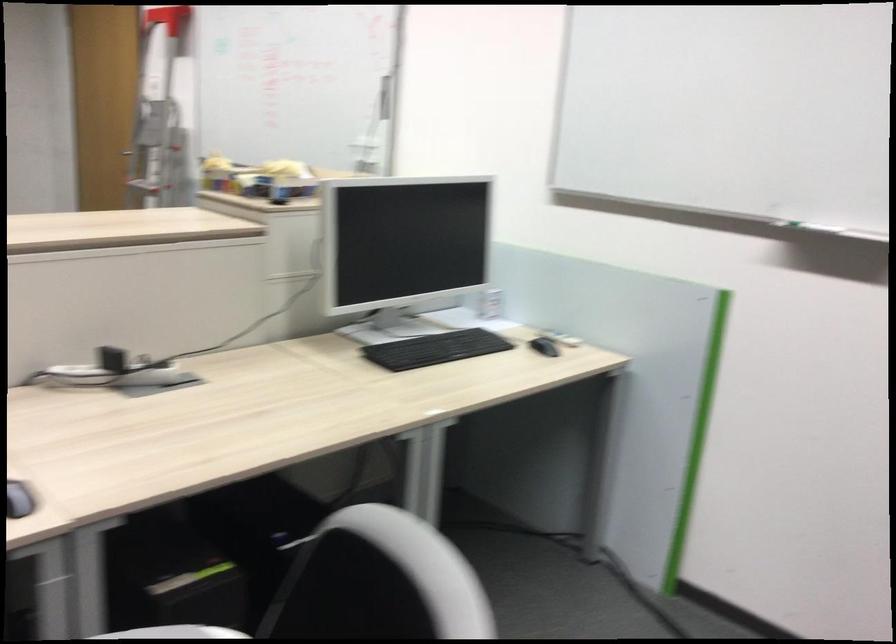
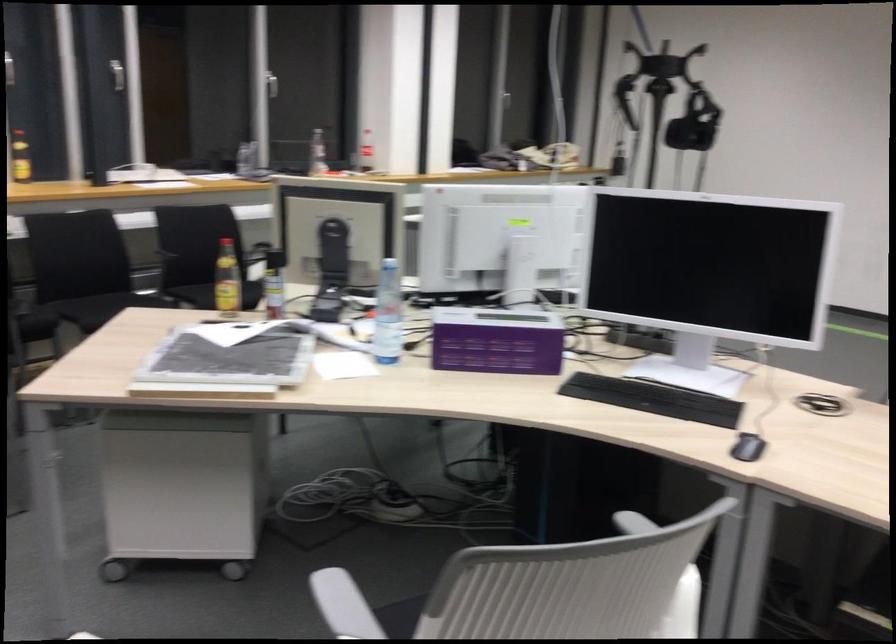
Question: The images are taken continuously from a first-person perspective. In which direction is your viewpoint rotating?

Choices:
 (A) Left
 (B) Right
 (C) Up
 (D) Down

Answer: (A)